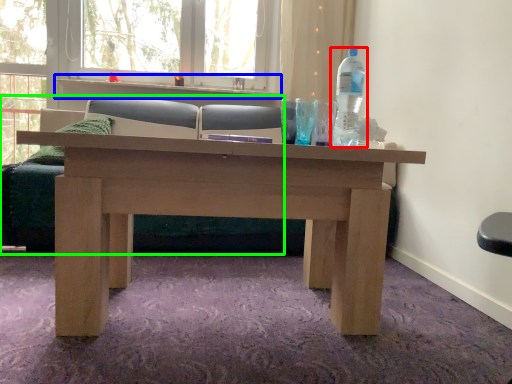
Question: Which is nearer to the bottle (highlighted by a red box)? window sill (highlighted by a blue box) or studio couch (highlighted by a green box).

Choices:
 (A) window sill
 (B) studio couch

Answer: (B)